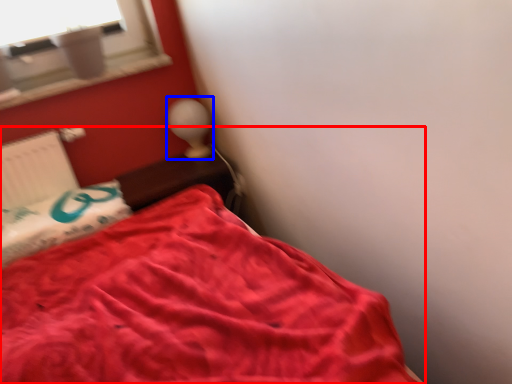
Question: Among these objects, which one is farthest to the camera, bed (highlighted by a red box) or table lamp (highlighted by a blue box)?

Choices:
 (A) bed
 (B) table lamp

Answer: (B)